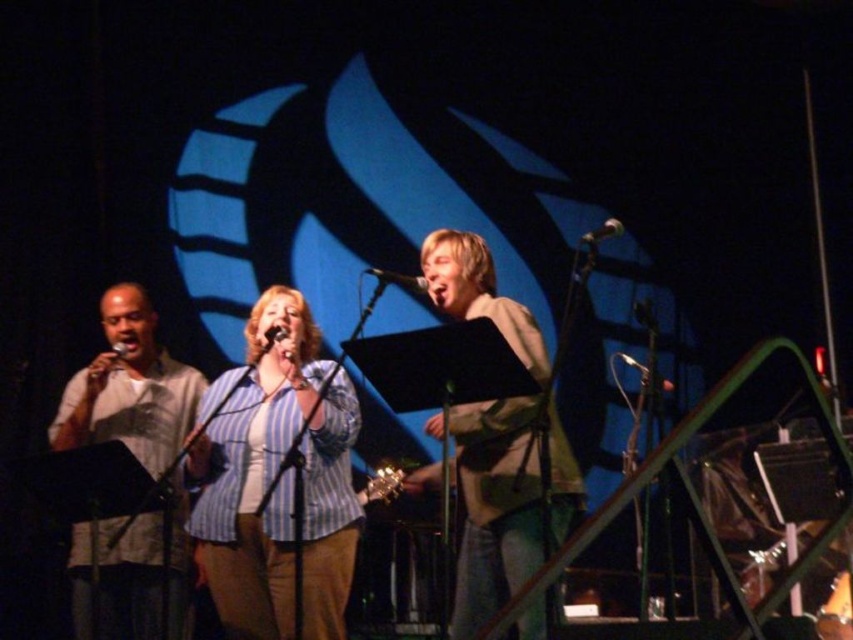
Question: Is light beige shirt at left thinner than metallic silver microphone at upper center?

Choices:
 (A) yes
 (B) no

Answer: (B)

Question: Which point is closer to the camera?

Choices:
 (A) (622, 230)
 (B) (80, 545)
 (C) (511, 458)

Answer: (A)

Question: Estimate the real-world distances between objects in this image. Which object is closer to the metallic silver microphone at upper center?

Choices:
 (A) metallic shiny microphone at left
 (B) black matte microphone at center
 (C) metallic silver microphone at center
 (D) light beige shirt at left

Answer: (B)

Question: Can you confirm if light beige shirt at left is positioned to the left of metallic silver microphone at center?

Choices:
 (A) no
 (B) yes

Answer: (B)

Question: Which of the following is the farthest from the observer?

Choices:
 (A) light beige shirt at left
 (B) blue striped shirt at center

Answer: (A)

Question: Is blue striped shirt at center wider than metallic silver microphone at center?

Choices:
 (A) yes
 (B) no

Answer: (A)